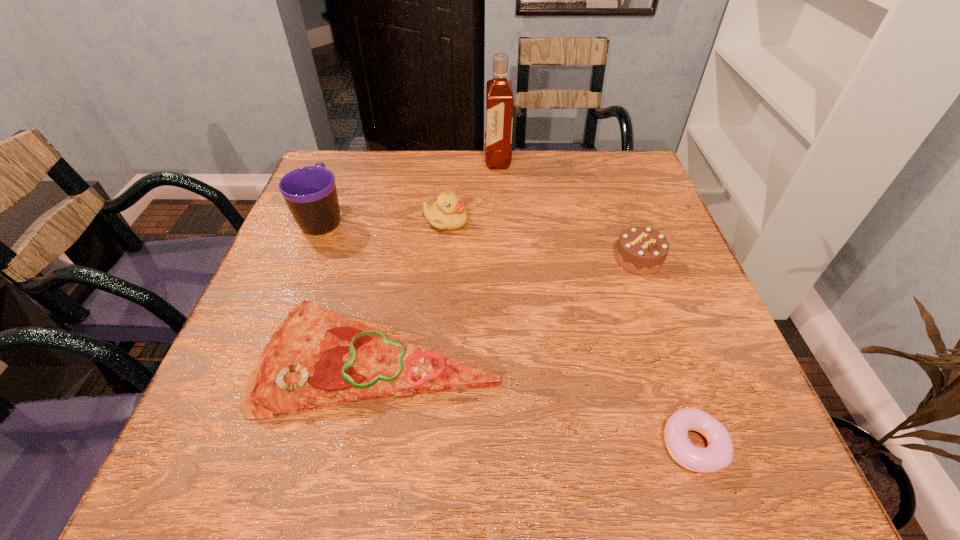
This screenshot has height=540, width=960. Identify the location of free space between the pizza and the duckling. (414, 290).

In order to click on vacant space in between the second tallest object and the doughnut in this screenshot , I will do `click(509, 331)`.

Locate which object is the fifth closest to the duckling. Please provide its 2D coordinates. Your answer should be formatted as a tuple, i.e. [(x, y)], where the tuple contains the x and y coordinates of a point satisfying the conditions above.

[(719, 453)]

Locate an element on the screen. The width and height of the screenshot is (960, 540). object that can be found as the third closest to the pizza is located at coordinates (719, 453).

Where is `free spot that satisfies the following two spatial constraints: 1. on the front label of the tallest object; 2. on the left side of the fourth farthest object`? This screenshot has width=960, height=540. free spot that satisfies the following two spatial constraints: 1. on the front label of the tallest object; 2. on the left side of the fourth farthest object is located at coordinates (503, 259).

Locate an element on the screen. The image size is (960, 540). free point that satisfies the following two spatial constraints: 1. on the front-facing side of the third nearest object; 2. on the left side of the duckling is located at coordinates (443, 259).

This screenshot has height=540, width=960. I want to click on vacant position in the image that satisfies the following two spatial constraints: 1. on the back side of the doughnut; 2. on the front-facing side of the duckling, so click(617, 221).

Where is `vacant region that satisfies the following two spatial constraints: 1. on the front-facing side of the doughnut; 2. on the right side of the duckling`? Image resolution: width=960 pixels, height=540 pixels. vacant region that satisfies the following two spatial constraints: 1. on the front-facing side of the doughnut; 2. on the right side of the duckling is located at coordinates (426, 444).

You are a GUI agent. You are given a task and a screenshot of the screen. Output one action in this format:
    pyautogui.click(x=<x>, y=<y>)
    Task: Click on the free space that satisfies the following two spatial constraints: 1. on the back side of the doughnut; 2. on the right side of the chocolate cake
    The width and height of the screenshot is (960, 540).
    Given the screenshot: What is the action you would take?
    pyautogui.click(x=630, y=259)

The image size is (960, 540). In order to click on vacant position in the image that satisfies the following two spatial constraints: 1. on the front-facing side of the duckling; 2. on the right side of the doughnut in this screenshot , I will do `click(426, 444)`.